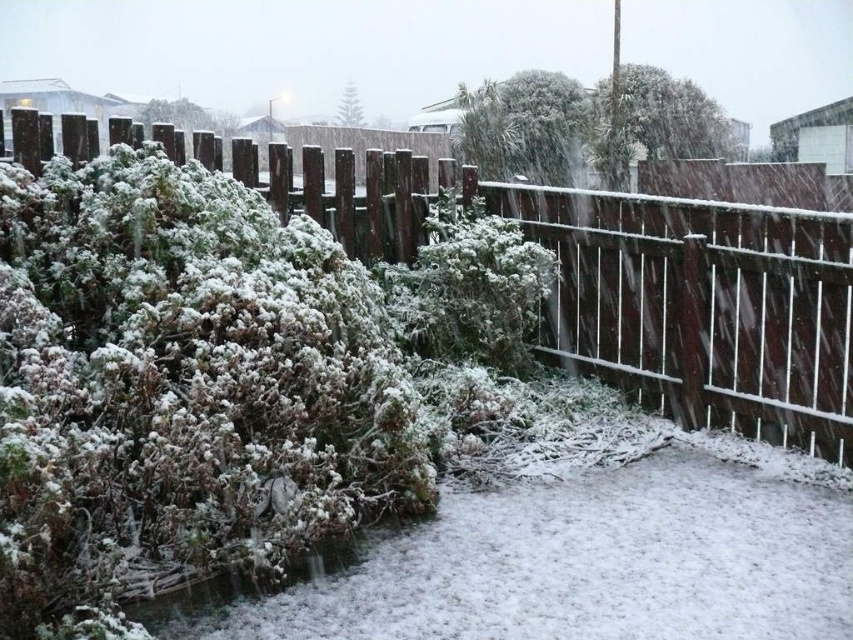
Question: Which of the following is the closest to the observer?

Choices:
 (A) (808, 364)
 (B) (482, 84)

Answer: (A)

Question: Does brown wooden fence at center have a greater width compared to frosted green bush at upper center?

Choices:
 (A) yes
 (B) no

Answer: (B)

Question: Does brown wooden fence at center lie behind frosted green bush at center?

Choices:
 (A) no
 (B) yes

Answer: (A)

Question: Which point is closer to the camera taking this photo?

Choices:
 (A) (381, 208)
 (B) (415, 337)
 (C) (550, 122)

Answer: (B)

Question: Is brown wooden fence at center above frosted green bush at upper center?

Choices:
 (A) yes
 (B) no

Answer: (B)

Question: Which object is farther from the camera taking this photo?

Choices:
 (A) frosted green bush at upper center
 (B) frosted green bush at center
 (C) brown wooden fence at center

Answer: (A)